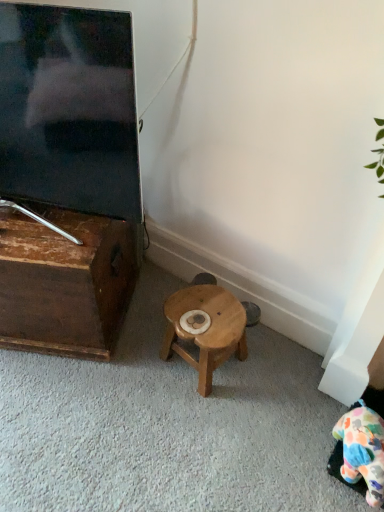
You are a GUI agent. You are given a task and a screenshot of the screen. Output one action in this format:
    pyautogui.click(x=<x>, y=<y>)
    Task: Click on the vacant area on top of wooden stool at center (from a real-world perspective)
    
    Given the screenshot: What is the action you would take?
    pyautogui.click(x=208, y=313)